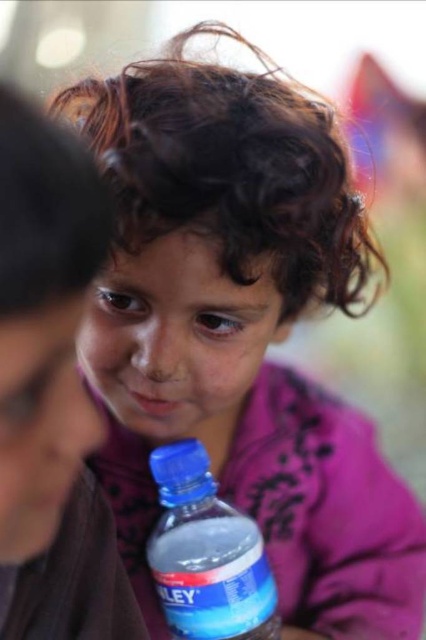
Question: Is matte plastic bottle at lower center above blue plastic bottle at lower center?

Choices:
 (A) no
 (B) yes

Answer: (B)

Question: Is matte plastic bottle at lower center to the right of blue plastic bottle at lower center from the viewer's perspective?

Choices:
 (A) yes
 (B) no

Answer: (B)

Question: Is matte plastic bottle at lower center smaller than blue plastic bottle at lower center?

Choices:
 (A) no
 (B) yes

Answer: (A)